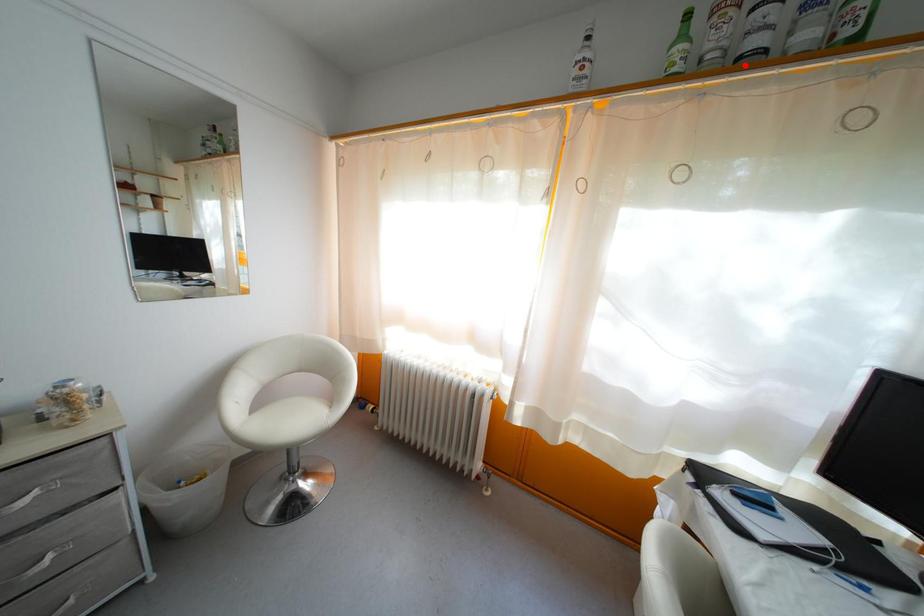
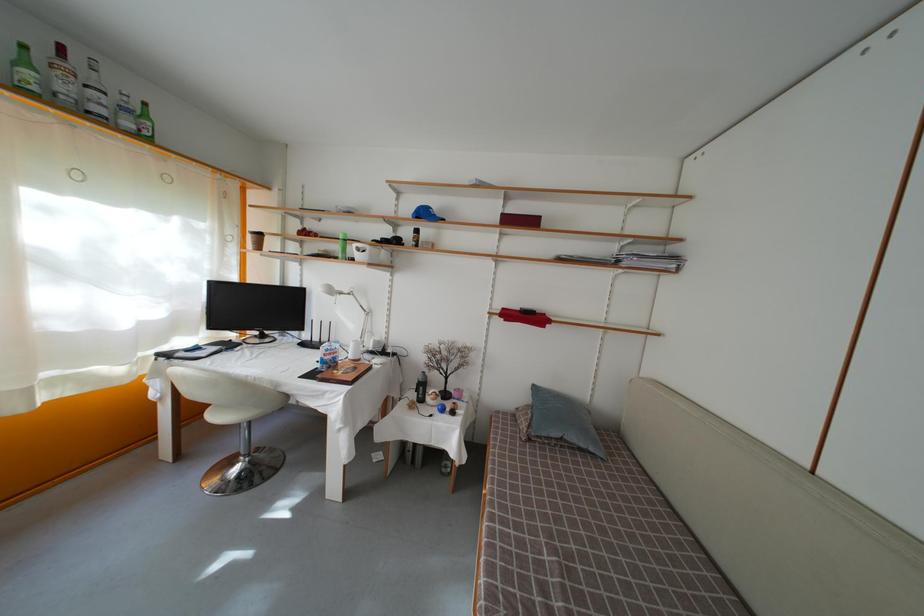
Locate, in the second image, the point that corresponds to the highlighted location in the first image.

(94, 119)